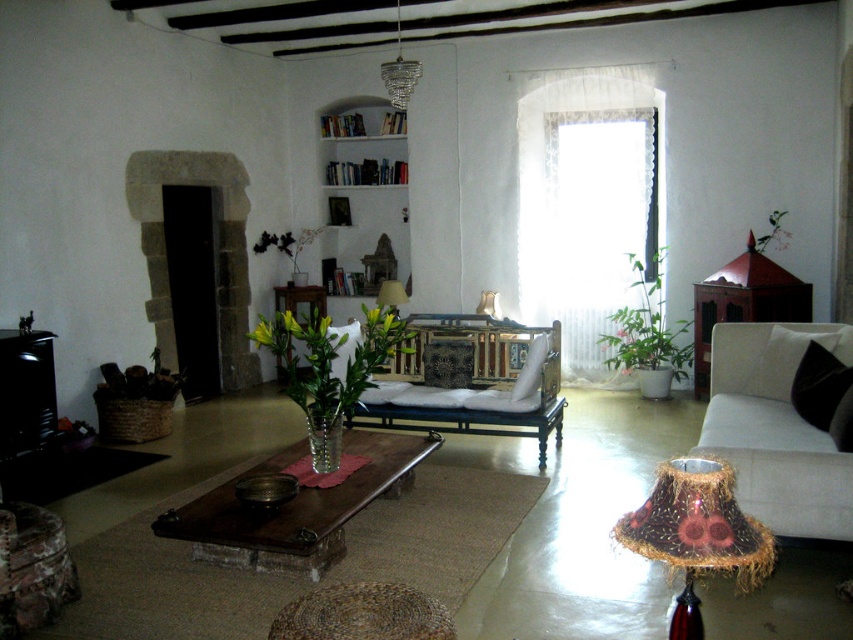
Question: Which object is the closest to the white wooden bookshelf at upper center?

Choices:
 (A) beige fabric couch at lower right
 (B) crystal glass chandelier at upper center

Answer: (B)

Question: Can you confirm if velvet floral pillow at center is positioned to the left of matte glass lampshade at center?

Choices:
 (A) yes
 (B) no

Answer: (B)

Question: Does black fabric pillow at right come in front of metallic gold lampshade at center?

Choices:
 (A) yes
 (B) no

Answer: (A)

Question: Can you confirm if white wooden bookshelf at upper center is positioned below translucent glass table at center?

Choices:
 (A) no
 (B) yes

Answer: (A)

Question: Which point is closer to the camera?

Choices:
 (A) translucent glass table at center
 (B) black fabric pillow at right
 (C) velvet floral pillow at center
 (D) fabric-covered lampshade at lower right

Answer: (D)

Question: Which of the following is the farthest from the observer?

Choices:
 (A) (305, 304)
 (B) (231, 282)
 (C) (367, 99)

Answer: (A)